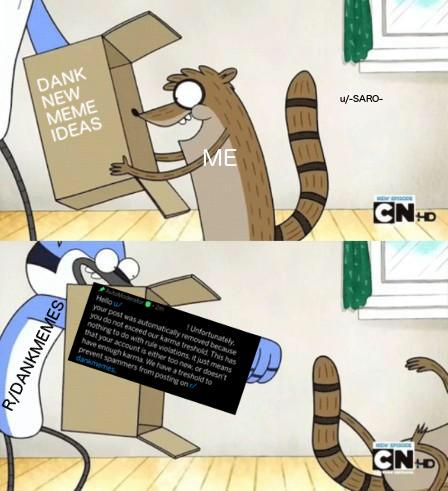
Where is `floor`? Image resolution: width=448 pixels, height=491 pixels. floor is located at coordinates (246, 466), (347, 227), (109, 220), (284, 210), (361, 460).